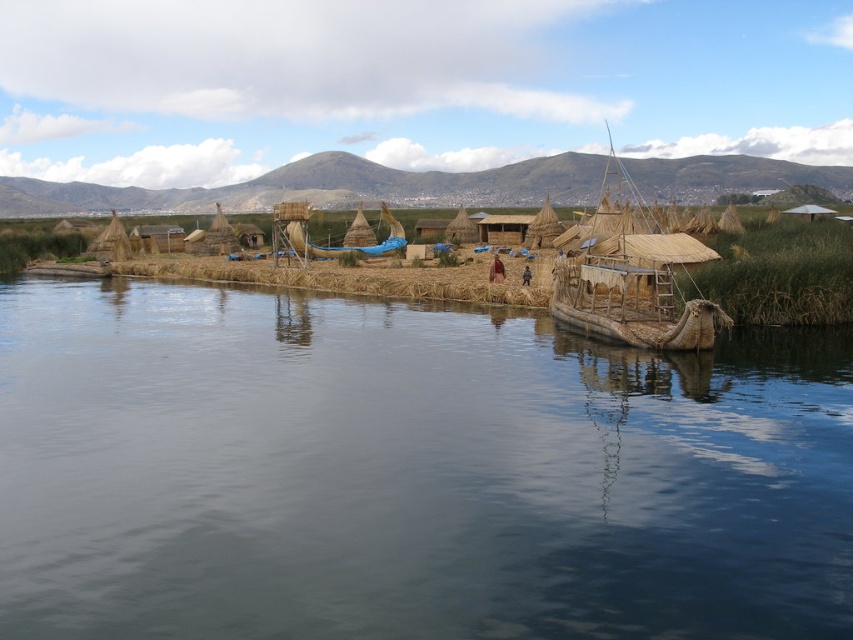
Is dark blue water at lower center above natural woven reed boat at center?

Incorrect, dark blue water at lower center is not positioned above natural woven reed boat at center.

Which is in front, point (815, 572) or point (718, 259)?

Point (815, 572) is in front.

Locate an element on the screen. This screenshot has height=640, width=853. dark blue water at lower center is located at coordinates (408, 472).

You are a GUI agent. You are given a task and a screenshot of the screen. Output one action in this format:
    pyautogui.click(x=<x>, y=<y>)
    Task: Click on the dark blue water at lower center
    The height and width of the screenshot is (640, 853).
    Given the screenshot: What is the action you would take?
    pyautogui.click(x=408, y=472)

Does natural woven reed boat at center have a greater width compared to blue fabric boat at center?

Yes, natural woven reed boat at center is wider than blue fabric boat at center.

Who is shorter, natural woven reed boat at center or blue fabric boat at center?

Standing shorter between the two is blue fabric boat at center.

Between point (578, 292) and point (311, 244), which one is positioned in front?

Point (578, 292) is more forward.

At what (x,y) coordinates should I click in order to perform the action: click on natural woven reed boat at center. Please return your answer as a coordinate pair (x, y). The width and height of the screenshot is (853, 640). Looking at the image, I should click on (631, 275).

Can you confirm if dark blue water at lower center is thinner than blue fabric boat at center?

In fact, dark blue water at lower center might be wider than blue fabric boat at center.

Based on the photo, does dark blue water at lower center have a larger size compared to blue fabric boat at center?

Yes, dark blue water at lower center is bigger than blue fabric boat at center.

Does point (6, 561) come closer to viewer compared to point (393, 234)?

That is True.

I want to click on dark blue water at lower center, so click(408, 472).